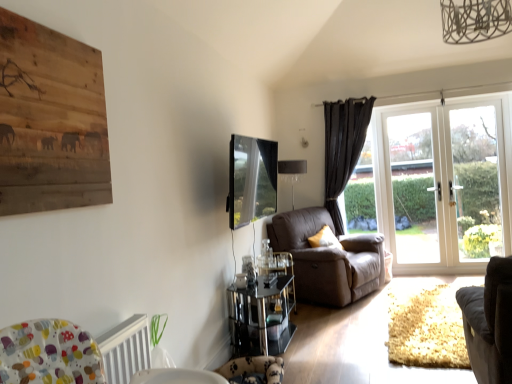
Question: Would you say brown leather couch at center, which is counted as the 1th chair, starting from the back, is inside or outside fluffy fabric swivel chair at lower center?

Choices:
 (A) inside
 (B) outside

Answer: (B)

Question: From the image's perspective, is brown leather couch at center, which is counted as the 1th chair, starting from the back, located above or below fluffy fabric swivel chair at lower center?

Choices:
 (A) above
 (B) below

Answer: (A)

Question: Which object is positioned closest to the white glass door at right?

Choices:
 (A) matte glass lampshade at upper center
 (B) brown leather couch at center, which appears as the second chair when viewed from the front
 (C) wooden painting at upper left
 (D) yellow fabric pillow at center
 (E) black velvet curtain at right

Answer: (E)

Question: Estimate the real-world distances between objects in this image. Which object is closer to the white textured radiator at lower left?

Choices:
 (A) white glass door at right
 (B) velvet dark gray armchair at lower right, marked as the first chair in a front-to-back arrangement
 (C) brown leather couch at center, which is counted as the 1th chair, starting from the back
 (D) matte glass lampshade at upper center
 (E) wooden painting at upper left

Answer: (E)